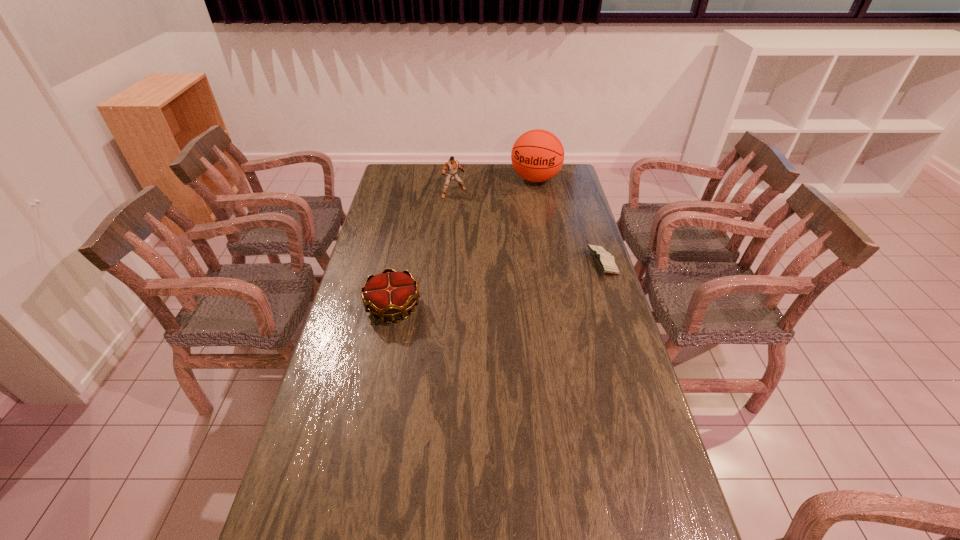
You are a GUI agent. You are given a task and a screenshot of the screen. Output one action in this format:
    pyautogui.click(x=<x>, y=<y>)
    Task: Click on the free spot on the desktop that is between the nearest object and the diary and is positioned on the side with logo of the third object from left to right
    
    Given the screenshot: What is the action you would take?
    pyautogui.click(x=492, y=286)

You are a GUI agent. You are given a task and a screenshot of the screen. Output one action in this format:
    pyautogui.click(x=<x>, y=<y>)
    Task: Click on the vacant spot on the desktop that is between the second shortest object and the rightmost object and is positioned on the front-facing side of the third object from right to left
    
    Given the screenshot: What is the action you would take?
    pyautogui.click(x=529, y=278)